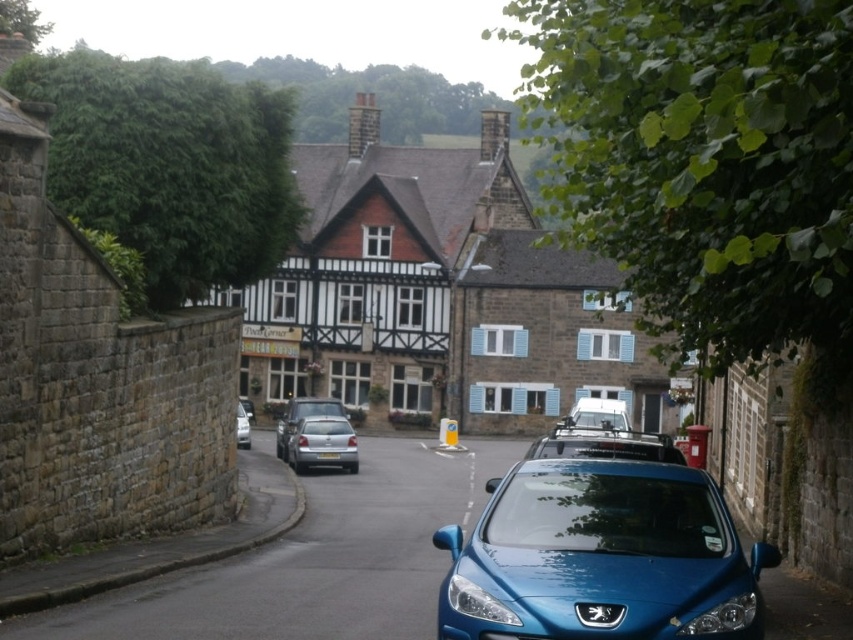
Question: Observing the image, what is the correct spatial positioning of blue metallic car at center in reference to silver metallic car at center?

Choices:
 (A) right
 (B) left

Answer: (A)

Question: Estimate the real-world distances between objects in this image. Which object is farther from the satin silver car at center?

Choices:
 (A) metallic blue car at lower center
 (B) white matte van at center

Answer: (A)

Question: Which point appears farthest from the camera in this image?

Choices:
 (A) (166, 634)
 (B) (322, 458)

Answer: (B)

Question: Can you confirm if blue metallic car at center is positioned above metallic blue car at lower center?

Choices:
 (A) yes
 (B) no

Answer: (B)

Question: Is satin silver car at center thinner than metallic silver car at center?

Choices:
 (A) no
 (B) yes

Answer: (A)

Question: Considering the real-world distances, which object is farthest from the satin silver car at center?

Choices:
 (A) black plastic license plate at center
 (B) metallic blue car at lower center
 (C) silver metallic car at center

Answer: (B)